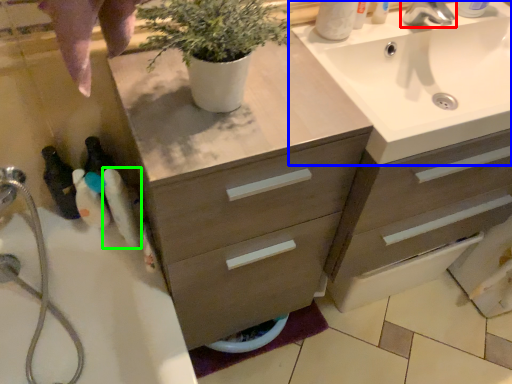
Question: Considering the real-world distances, which object is farthest from tap (highlighted by a red box)? sink (highlighted by a blue box) or toiletry (highlighted by a green box)?

Choices:
 (A) sink
 (B) toiletry

Answer: (B)